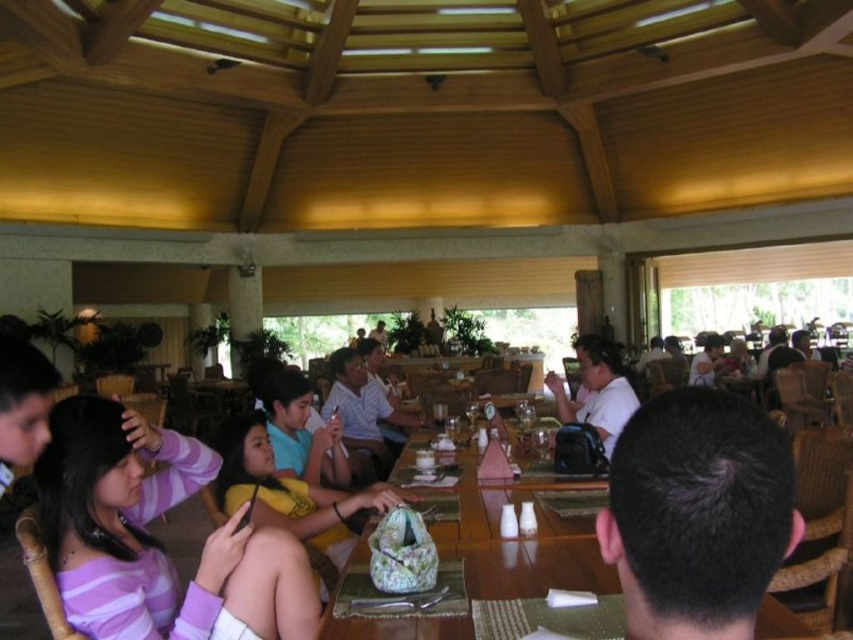
You are a customer sitting at a table in the dining area and notice two shirts hanging on the back of the chairs. Which shirt is positioned more to the left side between the matte blue shirt at center and the matte white shirt at center?

The matte blue shirt at center is positioned more to the left side compared to the matte white shirt at center.

You are a restaurant employee who needs to hang a coat on a hook located between the striped fabric shirt at left and the matte white shirt at center. Which shirt is closer to the hook?

The striped fabric shirt at left is shorter than the matte white shirt at center, so the hook is closer to the striped fabric shirt at left.

You are a customer sitting at a table in the dining area and want to see the person at the next table. Which object is closer to you between the dark brown hair at center and the matte blue shirt at center?

The dark brown hair at center is closer to the viewer than the matte blue shirt at center, so the dark brown hair at center would be closer to you.